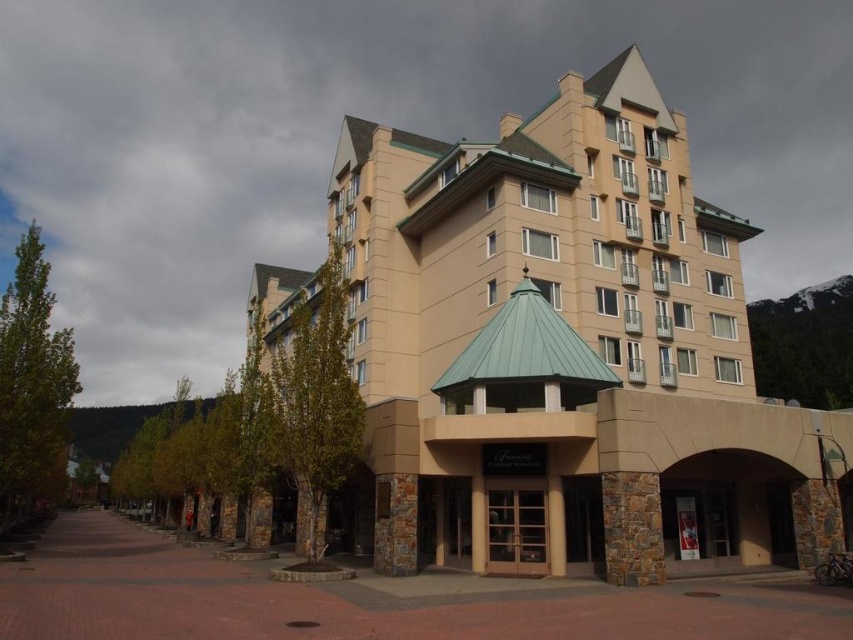
Which is behind, point (747, 221) or point (515, 561)?

The point (747, 221) is behind.

Does point (698, 381) come in front of point (531, 513)?

No, (698, 381) is behind (531, 513).

What do you see at coordinates (567, 348) in the screenshot? I see `beige stone building at center` at bounding box center [567, 348].

At what (x,y) coordinates should I click in order to perform the action: click on beige stone building at center. Please return your answer as a coordinate pair (x, y). The width and height of the screenshot is (853, 640). Looking at the image, I should click on (567, 348).